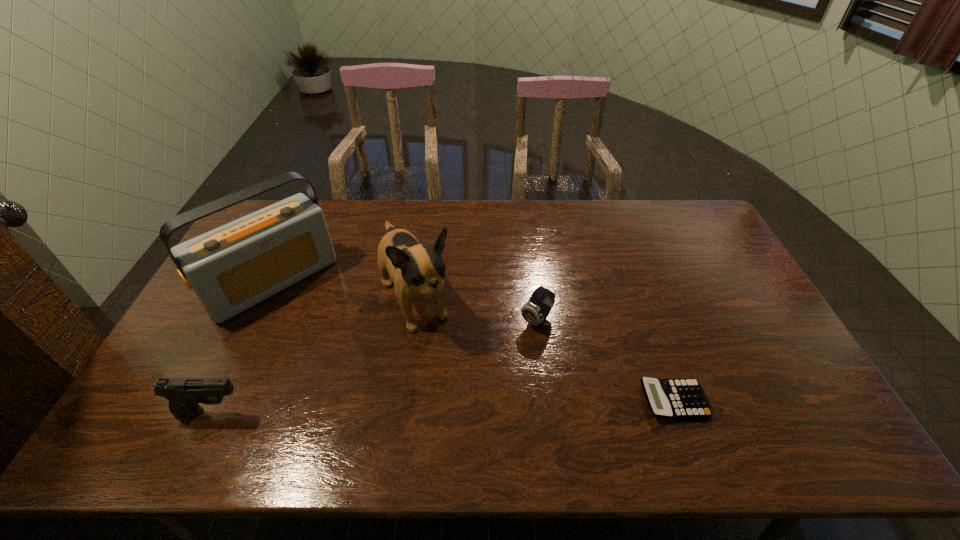
This screenshot has height=540, width=960. Find the location of `vacant spot on the desktop that is between the pistol and the shortest object and is positioned on the face of the watch`. vacant spot on the desktop that is between the pistol and the shortest object and is positioned on the face of the watch is located at coordinates (455, 406).

This screenshot has height=540, width=960. Identify the location of free space on the desktop that is between the pistol and the rightmost object and is positioned at the face of the puppy. (475, 406).

This screenshot has height=540, width=960. I want to click on vacant spot on the desktop that is between the pistol and the shortest object and is positioned on the front-facing side of the radio receiver, so click(x=391, y=407).